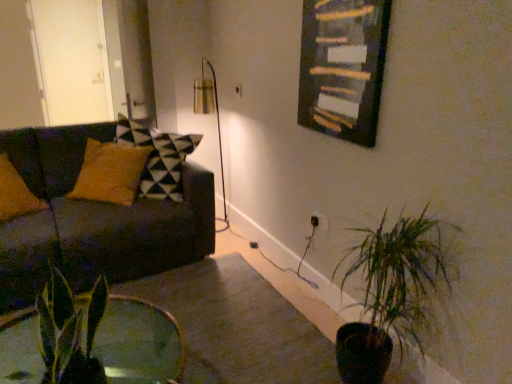
Question: From the image's perspective, is green leafy plant at lower right, arranged as the 2th houseplant when viewed from the front, on wooden frame at upper center?

Choices:
 (A) no
 (B) yes

Answer: (A)

Question: Considering the relative sizes of green leafy plant at lower right, the 1th houseplant positioned from the back, and wooden frame at upper center in the image provided, is green leafy plant at lower right, the 1th houseplant positioned from the back, taller than wooden frame at upper center?

Choices:
 (A) yes
 (B) no

Answer: (A)

Question: Is green leafy plant at lower right, arranged as the 2th houseplant when viewed from the front, thinner than wooden frame at upper center?

Choices:
 (A) yes
 (B) no

Answer: (B)

Question: Is green leafy plant at lower right, the 1th houseplant positioned from the back, outside wooden frame at upper center?

Choices:
 (A) yes
 (B) no

Answer: (A)

Question: Is green leafy plant at lower right, arranged as the 2th houseplant when viewed from the front, facing away from wooden frame at upper center?

Choices:
 (A) yes
 (B) no

Answer: (B)

Question: In terms of height, does white glossy door at upper left look taller or shorter compared to green leafy plant at lower right, the 1th houseplant positioned from the back?

Choices:
 (A) tall
 (B) short

Answer: (A)

Question: Based on their sizes in the image, would you say white glossy door at upper left is bigger or smaller than green leafy plant at lower right, arranged as the 2th houseplant when viewed from the front?

Choices:
 (A) big
 (B) small

Answer: (A)

Question: From a real-world perspective, is white glossy door at upper left physically located above or below green leafy plant at lower right, arranged as the 2th houseplant when viewed from the front?

Choices:
 (A) below
 (B) above

Answer: (B)

Question: Is white glossy door at upper left inside the boundaries of green leafy plant at lower right, arranged as the 1th houseplant when viewed from the right, or outside?

Choices:
 (A) outside
 (B) inside

Answer: (A)

Question: Is point (223, 205) positioned closer to the camera than point (31, 137)?

Choices:
 (A) closer
 (B) farther

Answer: (B)

Question: Considering their positions, is metallic gold table lamp at center located in front of or behind dark brown fabric couch at left?

Choices:
 (A) front
 (B) behind

Answer: (B)

Question: In terms of height, does metallic gold table lamp at center look taller or shorter compared to dark brown fabric couch at left?

Choices:
 (A) tall
 (B) short

Answer: (A)

Question: Which is correct: metallic gold table lamp at center is inside dark brown fabric couch at left, or outside of it?

Choices:
 (A) outside
 (B) inside

Answer: (A)

Question: In the image, is white glossy door at upper left on the left side or the right side of green glossy leaf at lower left, positioned as the 2th houseplant in right-to-left order?

Choices:
 (A) right
 (B) left

Answer: (B)

Question: Is white glossy door at upper left inside the boundaries of green glossy leaf at lower left, which appears as the 2th houseplant when viewed from the back, or outside?

Choices:
 (A) inside
 (B) outside

Answer: (B)